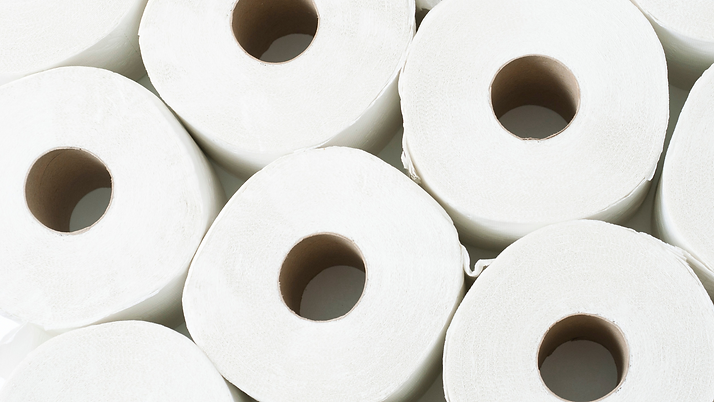
At what (x,y) coordinates should I click in order to perform the action: click on toilet paper rolls. Please return your answer as a coordinate pair (x, y). Looking at the image, I should click on [x=151, y=176], [x=311, y=188], [x=263, y=90], [x=445, y=92], [x=690, y=148], [x=690, y=17], [x=66, y=15], [x=528, y=296], [x=150, y=356].